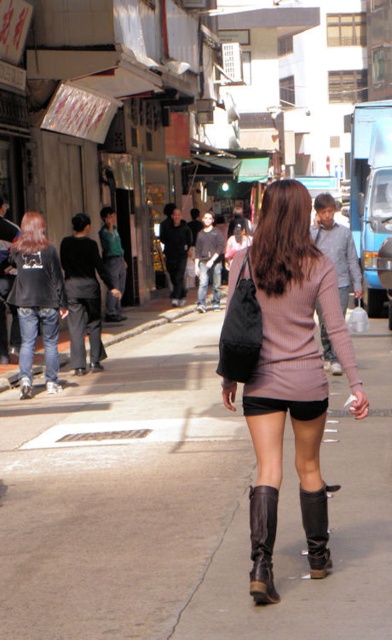
You are standing on the bustling urban street and see the matte black jacket at left. Can you determine its exact position relative to the other objects in the scene?

The matte black jacket at left is located at point [36,300] in the scene.

Where is the pale pink sweater at center located in the image?

The pale pink sweater at center is located at point (x=301, y=339) in the image.

Based on the scene description, where is the pale pink sweater at center in relation to the brown leather boot at lower center?

The pale pink sweater at center is to the right of the brown leather boot at lower center.